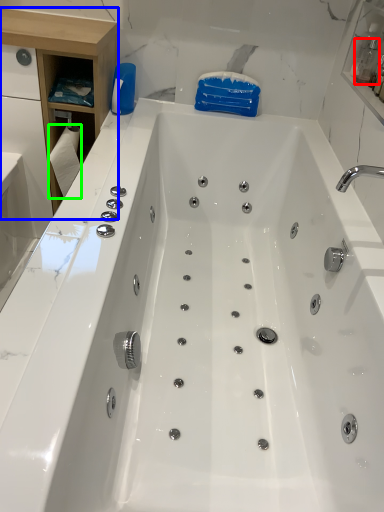
Question: Considering the real-world distances, which object is farthest from bottle (highlighted by a red box)? cabinetry (highlighted by a blue box) or toilet paper (highlighted by a green box)?

Choices:
 (A) cabinetry
 (B) toilet paper

Answer: (B)